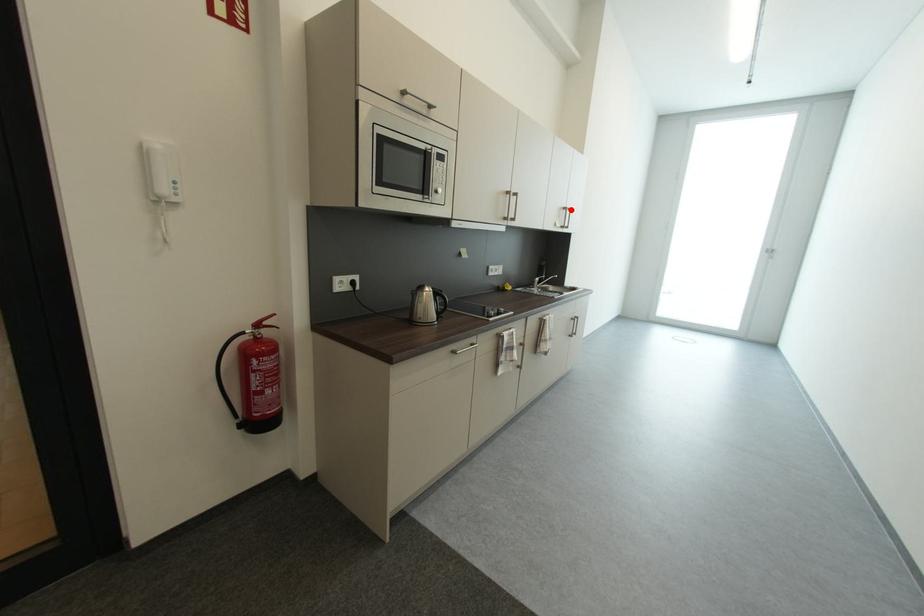
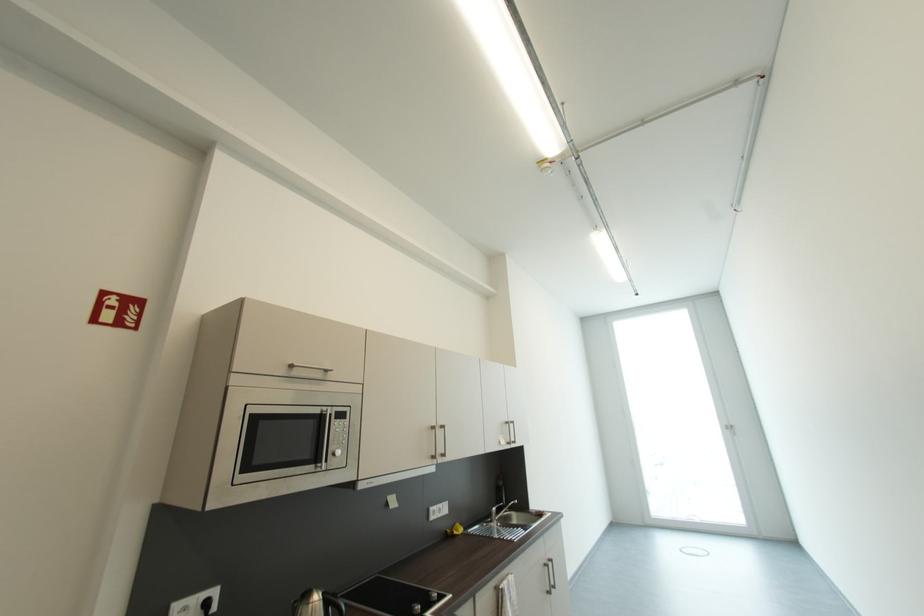
In the second image, find the point that corresponds to the highlighted location in the first image.

(513, 424)